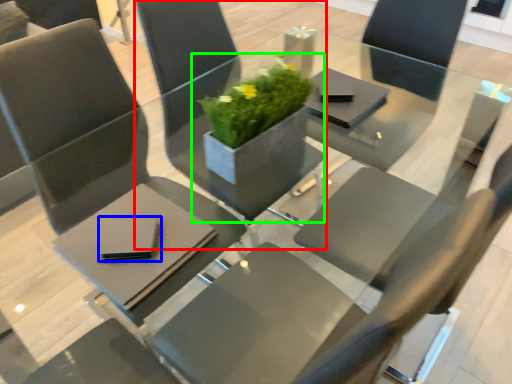
Question: Which object is positioned farthest from chair (highlighted by a red box)? Select from pad (highlighted by a blue box) and houseplant (highlighted by a green box).

Choices:
 (A) pad
 (B) houseplant

Answer: (A)